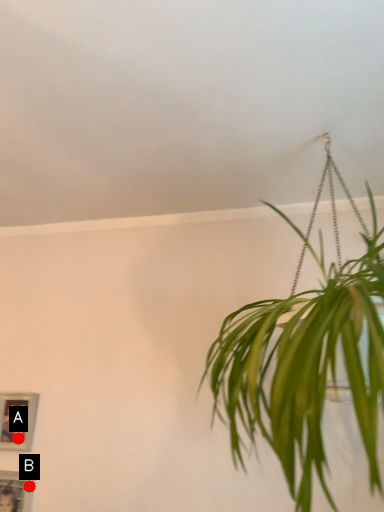
Question: Two points are circled on the image, labeled by A and B beside each circle. Which point appears farthest from the camera in this image?

Choices:
 (A) A is further
 (B) B is further

Answer: (A)